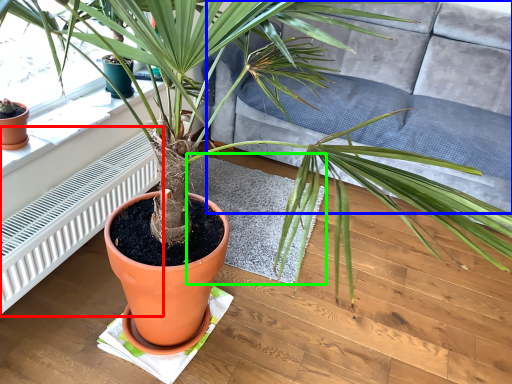
Question: Which object is the closest to the radiator (highlighted by a red box)? Choose among these: couch (highlighted by a blue box) or mat (highlighted by a green box).

Choices:
 (A) couch
 (B) mat

Answer: (B)